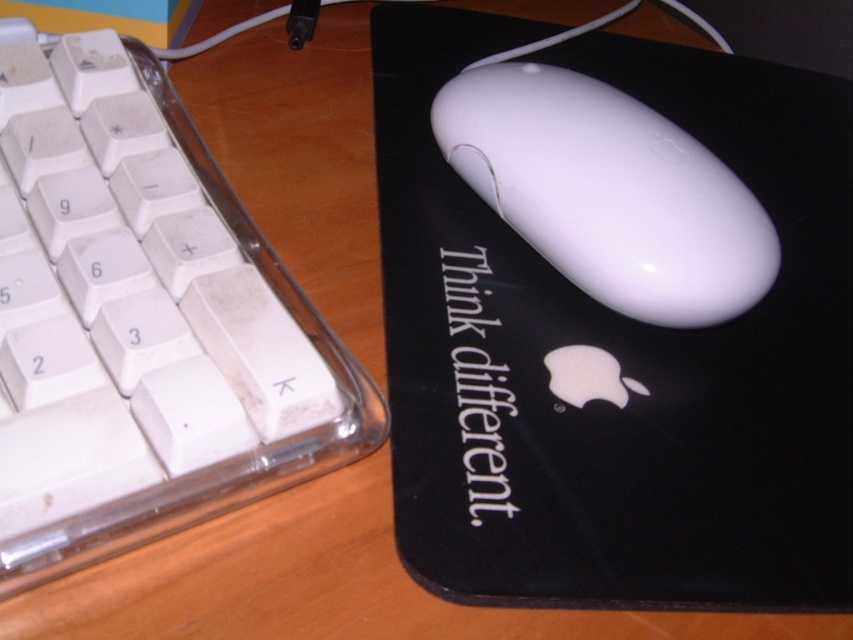
Can you confirm if white plastic keyboard at left is positioned to the right of white glossy mouse at center?

In fact, white plastic keyboard at left is to the left of white glossy mouse at center.

Can you confirm if white plastic keyboard at left is thinner than white glossy mouse at center?

In fact, white plastic keyboard at left might be wider than white glossy mouse at center.

Find the location of a particular element. white plastic keyboard at left is located at coordinates (143, 326).

Can you confirm if black matte mousepad at center is positioned below white plastic keyboard at left?

No.

Is black matte mousepad at center to the right of white plastic keyboard at left from the viewer's perspective?

Correct, you'll find black matte mousepad at center to the right of white plastic keyboard at left.

Is point (776, 92) in front of point (70, 72)?

No, it is not.

Identify the location of black matte mousepad at center. tap(616, 353).

Is point (799, 461) less distant than point (717, 166)?

Yes, it is.

Between point (616, 337) and point (694, 198), which one is positioned in front?

Positioned in front is point (694, 198).

Describe the element at coordinates (616, 353) in the screenshot. I see `black matte mousepad at center` at that location.

You are a GUI agent. You are given a task and a screenshot of the screen. Output one action in this format:
    pyautogui.click(x=<x>, y=<y>)
    Task: Click on the black matte mousepad at center
    The width and height of the screenshot is (853, 640).
    Given the screenshot: What is the action you would take?
    pyautogui.click(x=616, y=353)